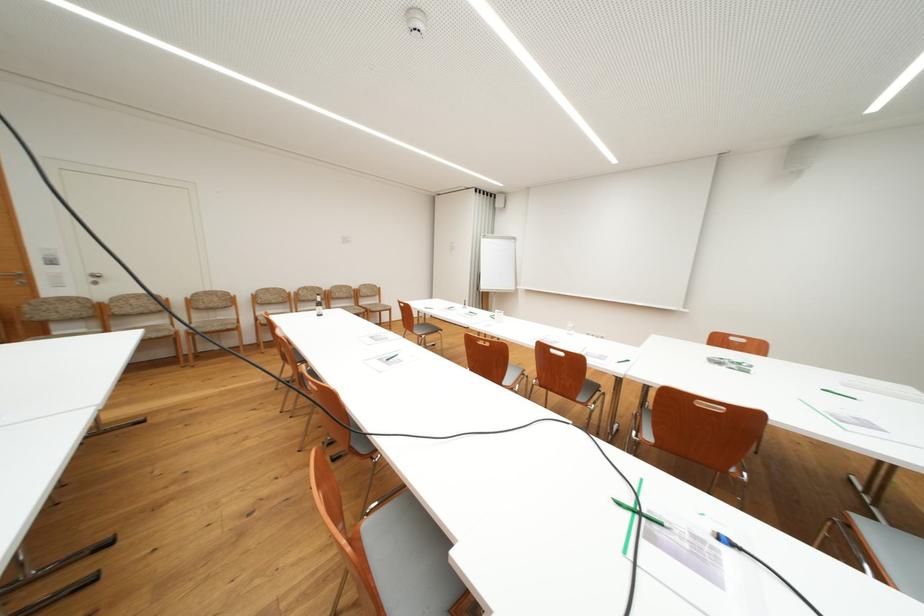
The location [569,328] corresponds to which object?

It refers to a water glass.